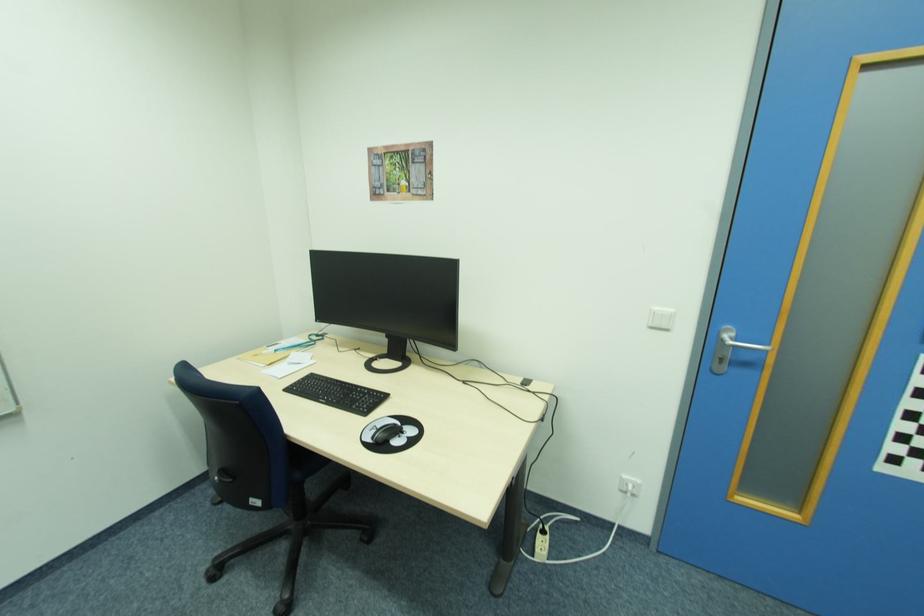
I want to click on silver door handle, so click(748, 346).